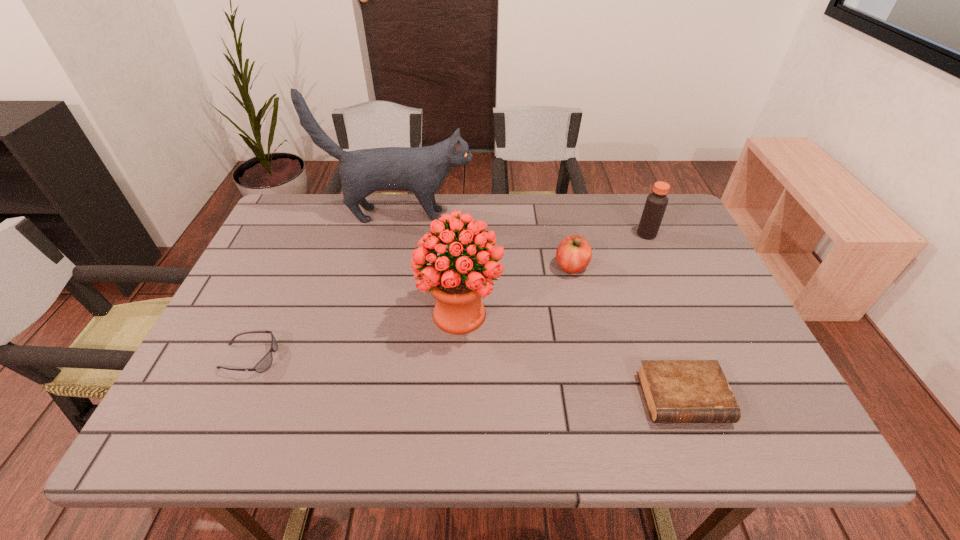
This screenshot has width=960, height=540. I want to click on free space at the far right corner of the desktop, so click(665, 222).

Where is `free space between the tallest object and the diary`? free space between the tallest object and the diary is located at coordinates (540, 306).

At what (x,y) coordinates should I click in order to perform the action: click on vacant area between the fourth shortest object and the diary. Please return your answer as a coordinate pair (x, y). Looking at the image, I should click on (664, 316).

Where is `free space between the fourth nearest object and the vinegar`? This screenshot has height=540, width=960. free space between the fourth nearest object and the vinegar is located at coordinates (609, 250).

I want to click on empty space between the cat and the diary, so click(x=540, y=306).

Where is `free space between the third tallest object and the diary`? The height and width of the screenshot is (540, 960). free space between the third tallest object and the diary is located at coordinates (664, 316).

This screenshot has height=540, width=960. Find the location of `vacant area between the cat and the diary`. vacant area between the cat and the diary is located at coordinates (540, 306).

Where is `vacant area between the diary and the fourth object from left to right`? This screenshot has height=540, width=960. vacant area between the diary and the fourth object from left to right is located at coordinates (627, 332).

Identify the location of vacant point located between the cat and the second farthest object. This screenshot has width=960, height=540. (523, 224).

Find the location of `vacant area that lies between the fourth nearest object and the vinegar`. vacant area that lies between the fourth nearest object and the vinegar is located at coordinates (609, 250).